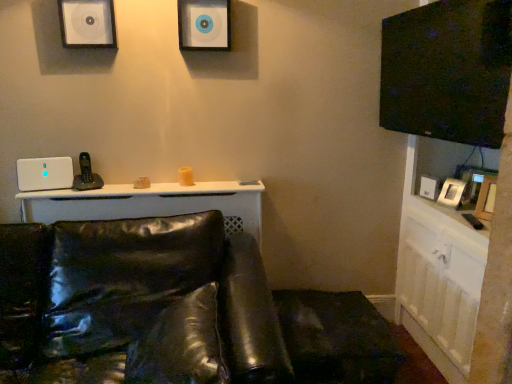
Question: Considering the relative positions of matte white speaker at upper center, positioned as the 1th speaker in top-to-bottom order, and white plastic speaker at left, placed as the 1th speaker when sorted from bottom to top, in the image provided, is matte white speaker at upper center, positioned as the 1th speaker in top-to-bottom order, behind white plastic speaker at left, placed as the 1th speaker when sorted from bottom to top,?

Choices:
 (A) yes
 (B) no

Answer: (B)

Question: From the image's perspective, would you say matte white speaker at upper center, positioned as the 1th speaker in top-to-bottom order, is shown under white plastic speaker at left, which appears as the third speaker when viewed from the right?

Choices:
 (A) no
 (B) yes

Answer: (A)

Question: Is matte white speaker at upper center, positioned as the 1th speaker in top-to-bottom order, positioned before white plastic speaker at left, which appears as the third speaker when viewed from the right?

Choices:
 (A) no
 (B) yes

Answer: (B)

Question: Is matte white speaker at upper center, which is the 3th speaker from left to right, not close to white plastic speaker at left, which appears as the third speaker when viewed from the right?

Choices:
 (A) yes
 (B) no

Answer: (B)

Question: Is white plastic speaker at left, which is the first speaker from left to right, surrounded by matte white speaker at upper center, which is the 3th speaker from left to right?

Choices:
 (A) yes
 (B) no

Answer: (B)

Question: Based on their positions, is matte white speaker at upper center, the first speaker from the right, located to the left or right of glossy leather couch at lower left?

Choices:
 (A) right
 (B) left

Answer: (A)

Question: In terms of width, does matte white speaker at upper center, the 3th speaker positioned from the bottom, look wider or thinner when compared to glossy leather couch at lower left?

Choices:
 (A) wide
 (B) thin

Answer: (B)

Question: Is matte white speaker at upper center, positioned as the 1th speaker in top-to-bottom order, bigger or smaller than glossy leather couch at lower left?

Choices:
 (A) small
 (B) big

Answer: (A)

Question: Considering their positions, is matte white speaker at upper center, the first speaker from the right, located in front of or behind glossy leather couch at lower left?

Choices:
 (A) behind
 (B) front

Answer: (A)

Question: Considering their positions, is glossy leather couch at lower left located in front of or behind white glossy dresser at right?

Choices:
 (A) front
 (B) behind

Answer: (A)

Question: Is glossy leather couch at lower left bigger or smaller than white glossy dresser at right?

Choices:
 (A) big
 (B) small

Answer: (A)

Question: From a real-world perspective, relative to white glossy dresser at right, is glossy leather couch at lower left vertically above or below?

Choices:
 (A) below
 (B) above

Answer: (A)

Question: Considering the relative positions of glossy leather couch at lower left and white glossy dresser at right in the image provided, is glossy leather couch at lower left to the left or to the right of white glossy dresser at right?

Choices:
 (A) right
 (B) left

Answer: (B)

Question: Based on their positions, is white plastic speaker at left, positioned as the third speaker in top-to-bottom order, located to the left or right of white glossy dresser at right?

Choices:
 (A) right
 (B) left

Answer: (B)

Question: From a real-world perspective, is white plastic speaker at left, which is the first speaker from left to right, physically located above or below white glossy dresser at right?

Choices:
 (A) above
 (B) below

Answer: (A)